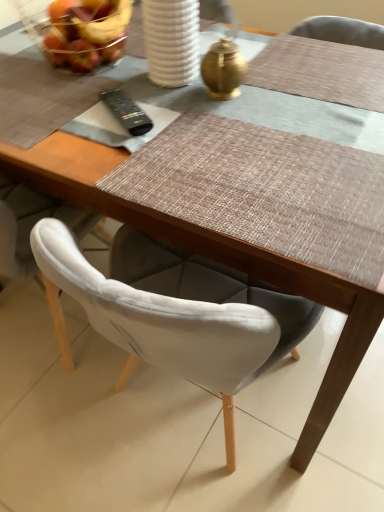
The width and height of the screenshot is (384, 512). What are the coordinates of `vacant space to the right of black plastic remote at center` in the screenshot? It's located at (203, 118).